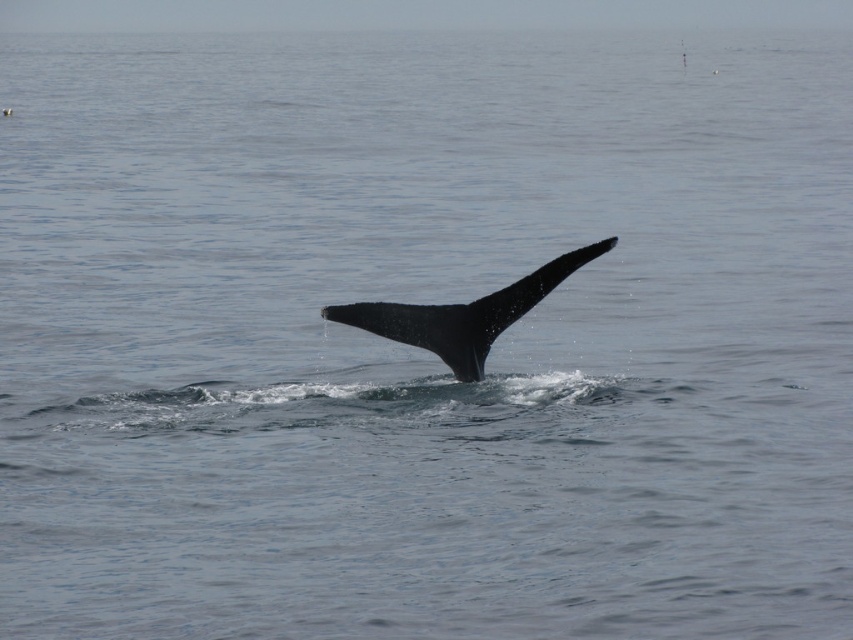
Question: Which object is closer to the camera taking this photo?

Choices:
 (A) black smooth fin at center
 (B) black matte whale tail at center

Answer: (A)

Question: Which point is closer to the camera taking this photo?

Choices:
 (A) (461, 332)
 (B) (608, 241)

Answer: (B)

Question: Which of the following is the farthest from the observer?

Choices:
 (A) black matte whale tail at center
 (B) black smooth fin at center

Answer: (A)

Question: Considering the relative positions of black matte whale tail at center and black smooth fin at center in the image provided, where is black matte whale tail at center located with respect to black smooth fin at center?

Choices:
 (A) left
 (B) right

Answer: (A)

Question: Is black matte whale tail at center wider than black smooth fin at center?

Choices:
 (A) yes
 (B) no

Answer: (A)

Question: Is black matte whale tail at center to the left of black smooth fin at center from the viewer's perspective?

Choices:
 (A) no
 (B) yes

Answer: (B)